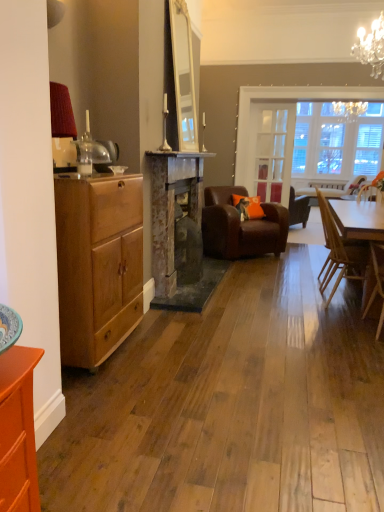
Question: Which is correct: light brown wooden chair at right, which is counted as the 4th chair, starting from the back, is inside clear glass door at center, or outside of it?

Choices:
 (A) inside
 (B) outside

Answer: (B)

Question: From the image's perspective, is light brown wooden chair at right, arranged as the 1th chair when viewed from the front, located above or below clear glass door at center?

Choices:
 (A) above
 (B) below

Answer: (B)

Question: Estimate the real-world distances between objects in this image. Which object is closer to the brown leather armchair at center, which ranks as the 2th chair in back-to-front order?

Choices:
 (A) rustic stone fireplace at center
 (B) brown leather armchair at center, the first chair in the back-to-front sequence
 (C) orange fabric pillow at center
 (D) light brown wooden chair at right, which is counted as the 4th chair, starting from the back
 (E) wooden chair at right, marked as the third chair in a back-to-front arrangement

Answer: (C)

Question: Estimate the real-world distances between objects in this image. Which object is closer to the matte wood chest of drawers at left?

Choices:
 (A) rustic stone fireplace at center
 (B) orange fabric pillow at center
 (C) wooden chair at right, marked as the third chair in a back-to-front arrangement
 (D) clear glass door at center
 (E) brown leather armchair at center, the first chair in the back-to-front sequence

Answer: (A)